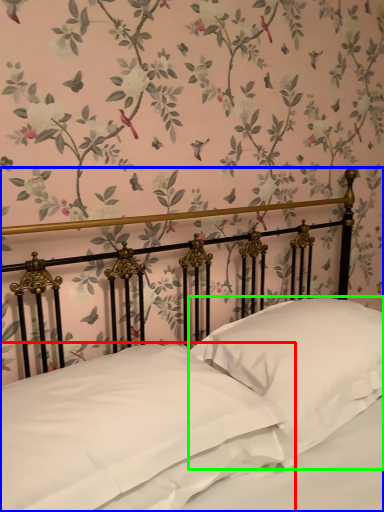
Question: Which object is the farthest from pillow (highlighted by a red box)? Choose among these: bed (highlighted by a blue box) or pillow (highlighted by a green box).

Choices:
 (A) bed
 (B) pillow

Answer: (B)